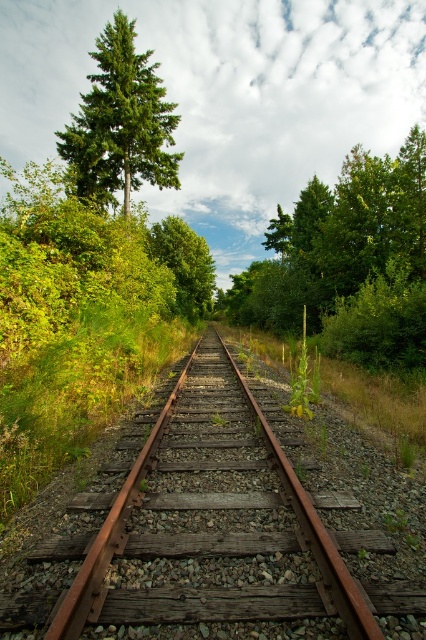
You are a surveyor tasked with marking the exact location of the green matte tree at upper left for a new railway safety sign. According to the coordinates provided, where should you place the sign relative to the railway tracks?

The green matte tree at upper left is located at coordinates point (x=120, y=122), so the sign should be placed at that exact position relative to the railway tracks.

You are standing at the origin point of the coordinate system in the image. You want to walk to the rusty metal train track at center. Which direction should you move in terms of x and y coordinates?

You should move towards the x coordinate 0.816 and y coordinate 0.493 to reach the rusty metal train track at center.

You are a photographer planning to capture the rusty metal train track at center and the green matte tree at upper left in a single frame. Which object will appear narrower in the photo?

The rusty metal train track at center will appear narrower in the photo because it is thinner than the green matte tree at upper left.